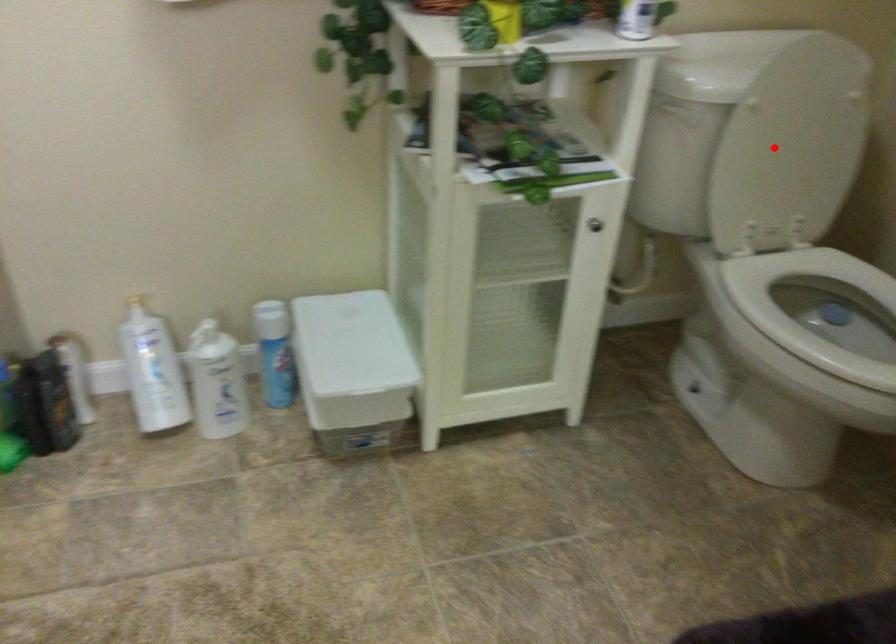
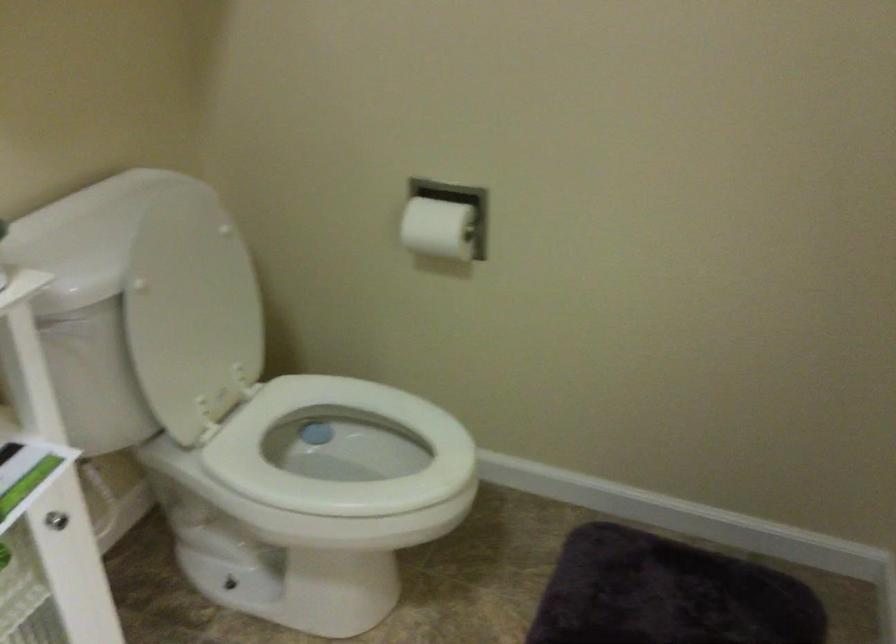
The point at the highlighted location is marked in the first image. Where is the corresponding point in the second image?

(192, 315)